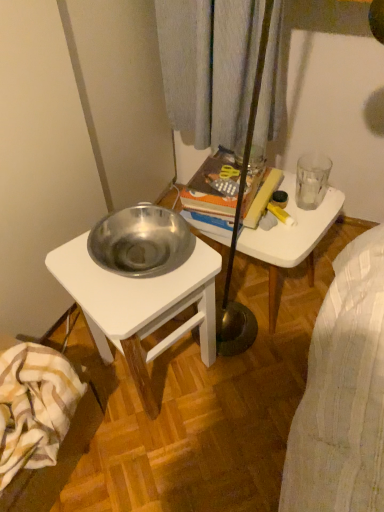
I want to click on free point in front of transparent glass at upper right, so click(306, 229).